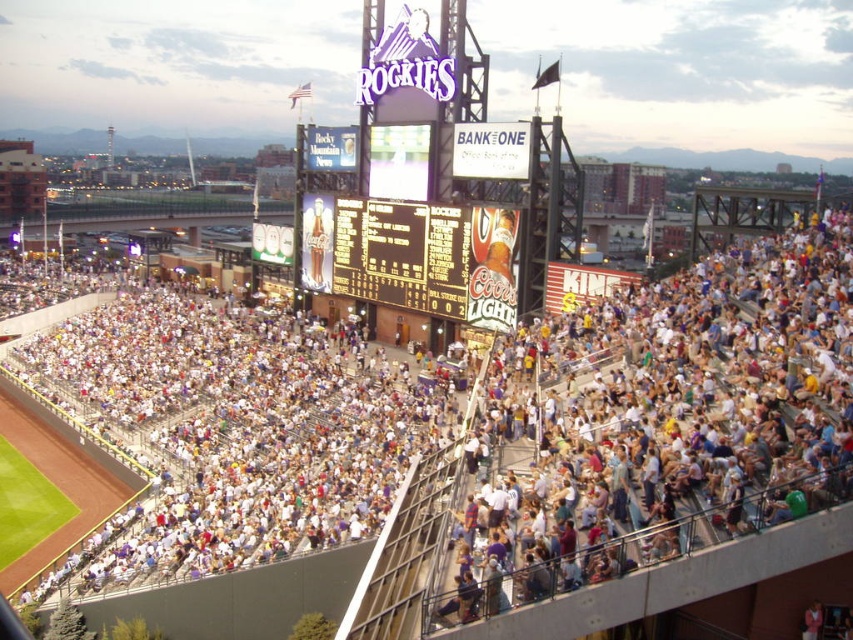
You are standing at the point marked by the coordinate point [468,442] in the baseball stadium. What object is located exactly at that coordinate?

The white plastic seats at center is located exactly at the coordinate point [468,442].

You are a photographer trying to capture a wide shot of the baseball stadium. You notice the white plastic seats at center and the black plastic scoreboard at center. Which object should you focus on to ensure both are clearly visible in your photo?

The white plastic seats at center are bigger than the black plastic scoreboard at center, so focusing on the white plastic seats at center will help ensure both objects are clearly visible in the photo.